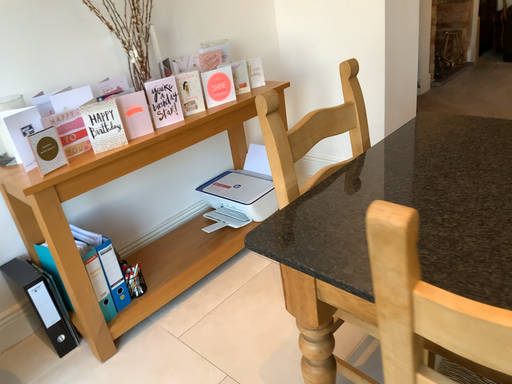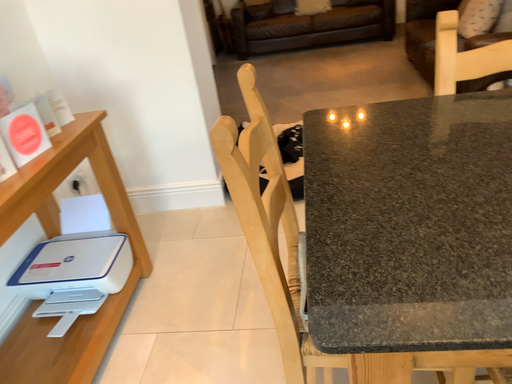
Question: How did the camera likely rotate when shooting the video?

Choices:
 (A) rotated downward
 (B) rotated upward

Answer: (B)